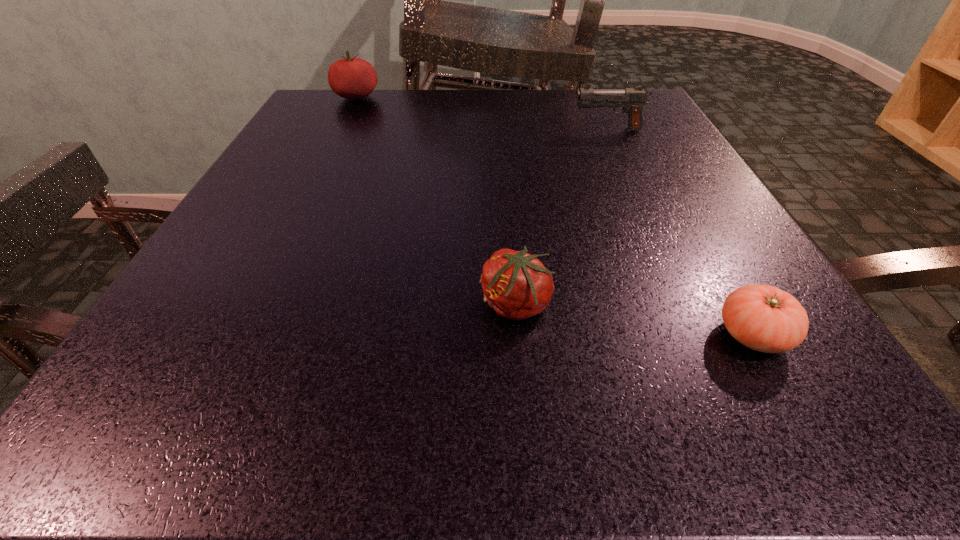
Find the location of a particular element. This screenshot has width=960, height=540. free space in the image that satisfies the following two spatial constraints: 1. in the direction the gun is aimed; 2. on the right side of the rightmost tomato is located at coordinates (701, 335).

What are the coordinates of `vacant space that satisfies the following two spatial constraints: 1. on the front side of the second tomato from left to right; 2. on the right side of the leftmost tomato` in the screenshot? It's located at (253, 304).

Where is `free location that satisfies the following two spatial constraints: 1. on the front side of the leftmost tomato; 2. on the left side of the rightmost tomato`? The height and width of the screenshot is (540, 960). free location that satisfies the following two spatial constraints: 1. on the front side of the leftmost tomato; 2. on the left side of the rightmost tomato is located at coordinates (238, 335).

The image size is (960, 540). In order to click on vacant region that satisfies the following two spatial constraints: 1. on the front side of the rightmost tomato; 2. on the right side of the leftmost tomato in this screenshot , I will do `click(238, 335)`.

Where is `vacant space that satisfies the following two spatial constraints: 1. on the back side of the rightmost tomato; 2. in the direction the second farthest object is aimed`? The width and height of the screenshot is (960, 540). vacant space that satisfies the following two spatial constraints: 1. on the back side of the rightmost tomato; 2. in the direction the second farthest object is aimed is located at coordinates point(637,130).

The width and height of the screenshot is (960, 540). Identify the location of vacant space that satisfies the following two spatial constraints: 1. on the front side of the third object from right to left; 2. on the right side of the farthest object. (253, 304).

Identify the location of vacant space that satisfies the following two spatial constraints: 1. in the direction the second farthest object is aimed; 2. on the back side of the rightmost tomato. The height and width of the screenshot is (540, 960). (701, 335).